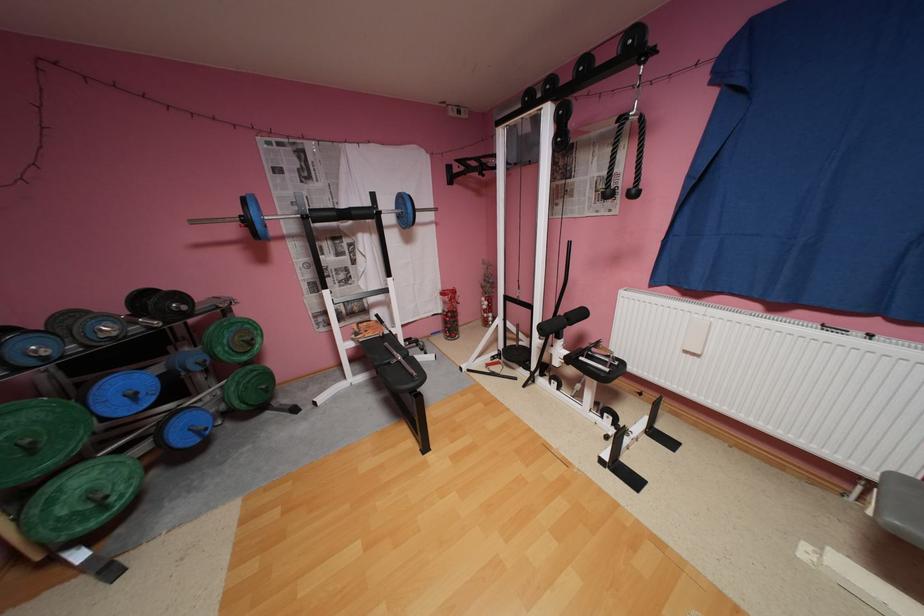
This screenshot has height=616, width=924. What do you see at coordinates (625, 156) in the screenshot? I see `the rope pull handle` at bounding box center [625, 156].